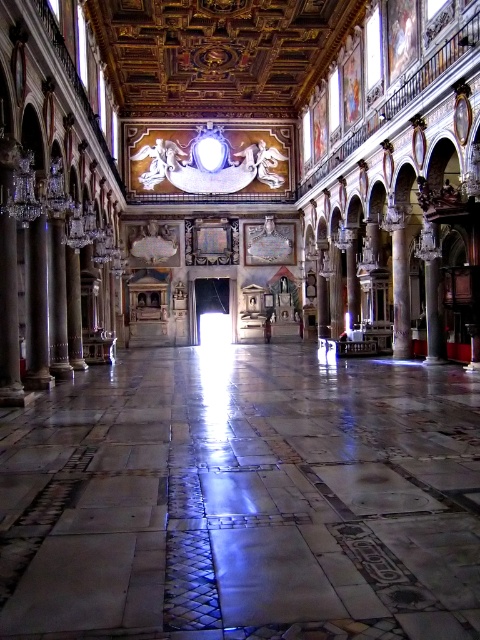
You are an architect assessing the structural integrity of the building. You notice the white marble pillar at left and the marble column at center. Which of these two supports is more slender in diameter?

The white marble pillar at left is thinner than the marble column at center, making it more slender in diameter.

Consider the image. You are standing in the nave of the cathedral and notice two points marked on the wall. One is at coordinate point [194,356] and the other at point [44,266]. Which point is closer to your current position?

Point [44,266] is closer to your current position because it is nearer to the camera compared to point [194,356], which is further away.

You are an architect analyzing the structural integrity of the building. You notice the white marble pillar at left and the marble column at center. Which one is positioned lower in the structure?

The white marble pillar at left is positioned lower in the structure as it is below the marble column at center.